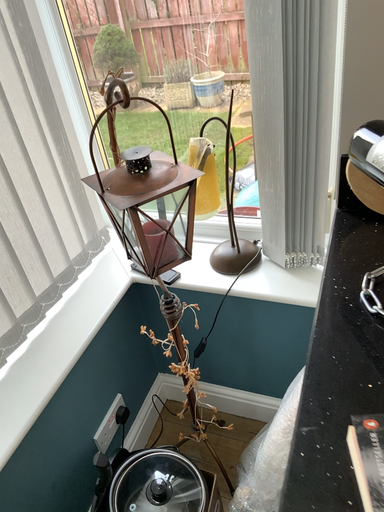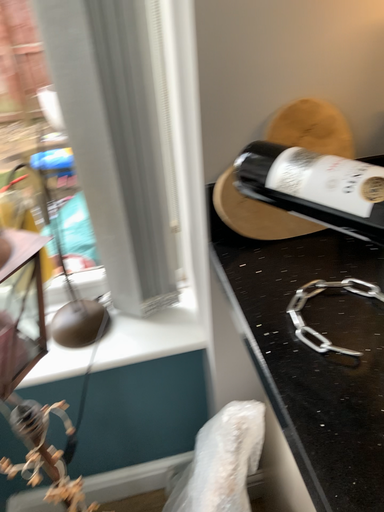
Question: Which way did the camera rotate in the video?

Choices:
 (A) rotated downward
 (B) rotated upward

Answer: (B)